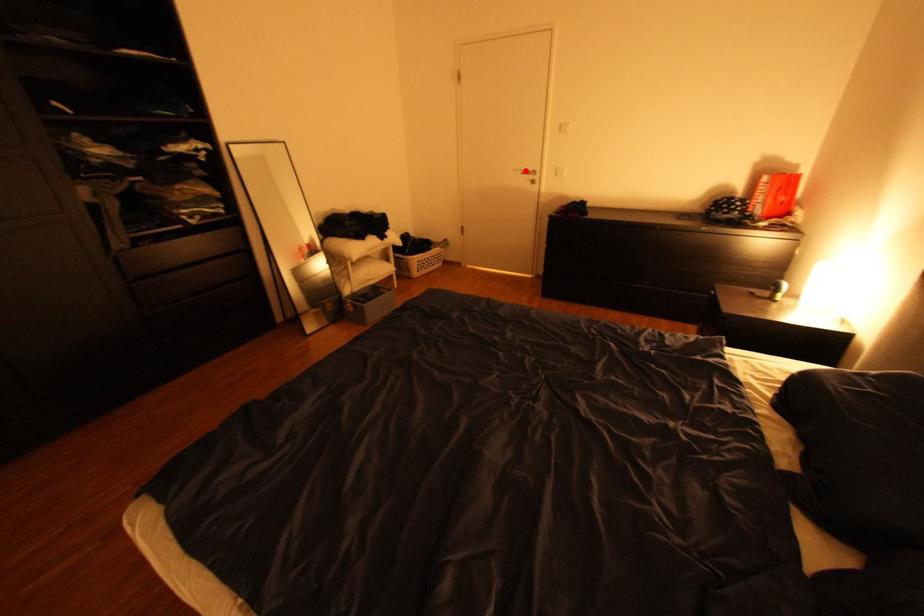
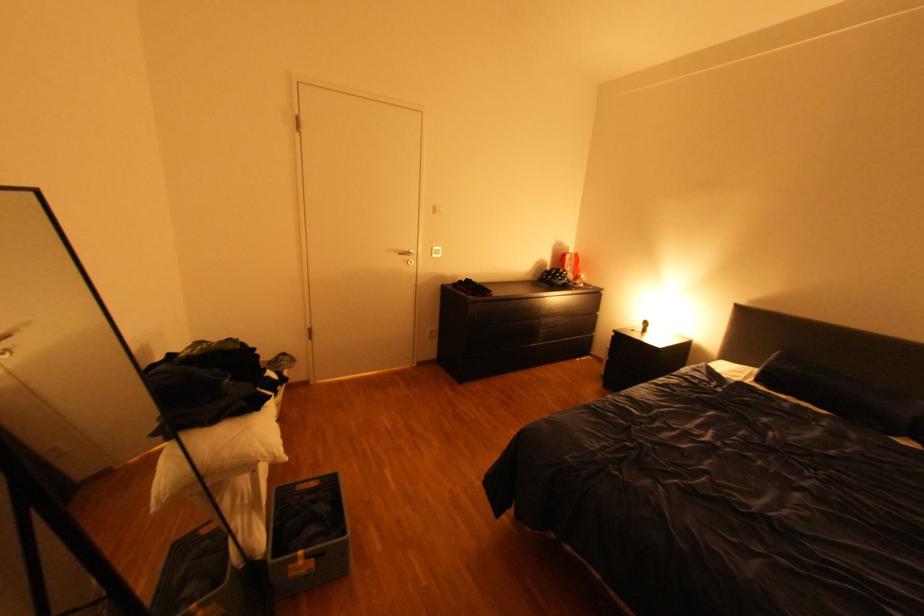
In the second image, find the point that corresponds to the highlighted location in the first image.

(399, 249)